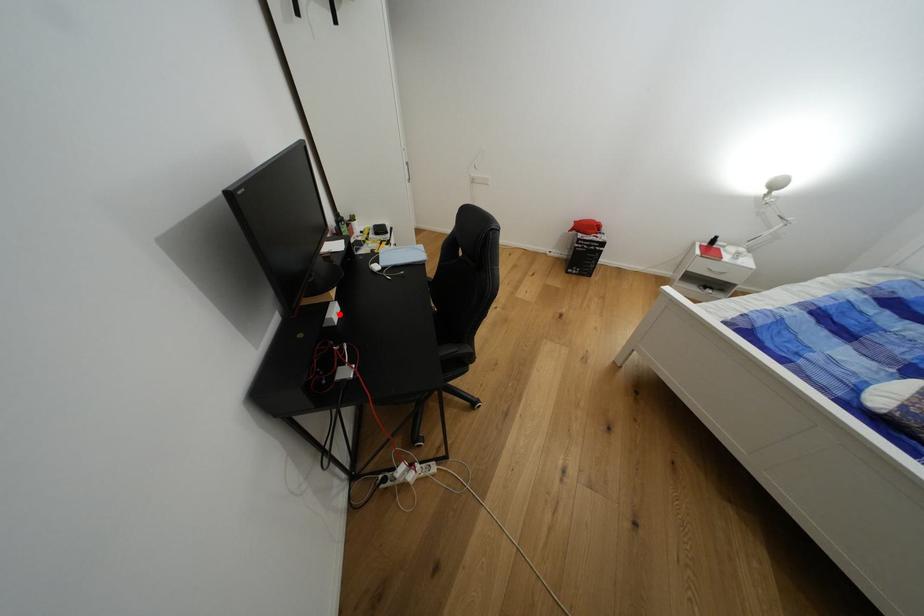
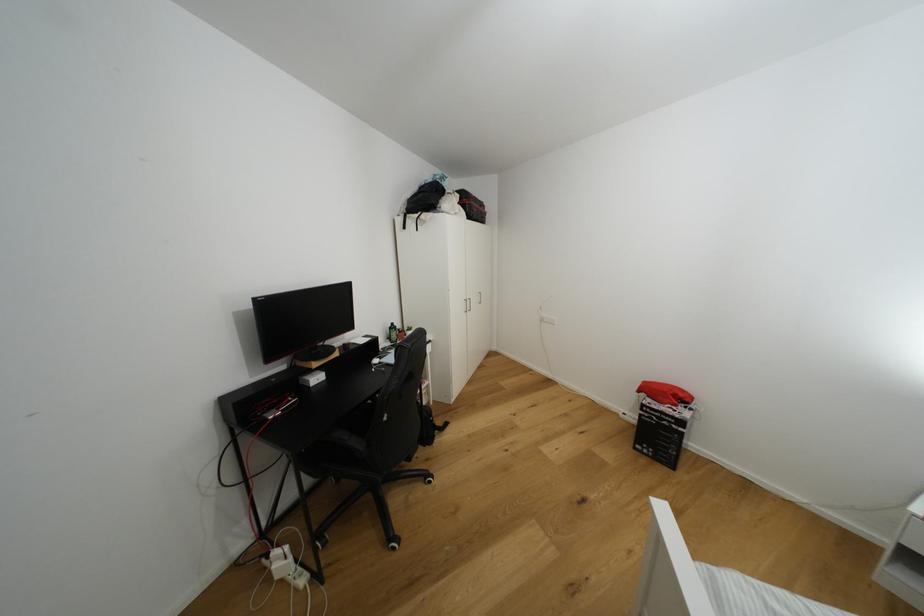
Where in the second image is the point corresponding to the highlighted location from the first image?

(322, 379)